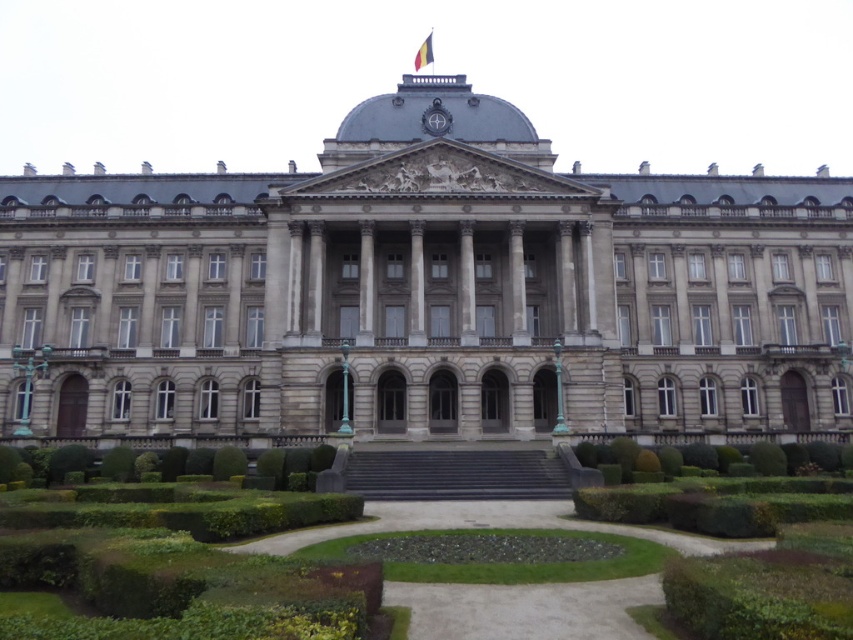
You are a photographer planning to take a photo of the gray stone palace at center and the green leafy bush at center from a distance. Which object will appear bigger in the photo?

The gray stone palace at center will appear bigger in the photo because it is larger in size than the green leafy bush at center.

You are standing in front of the grand neoclassical building and want to determine the relative positions of two points marked on the facade. Which point is closer to you, point (x=618, y=221) or point (x=238, y=465)?

Point (x=618, y=221) is further to the viewer than point (x=238, y=465), so point (x=238, y=465) is closer to you.